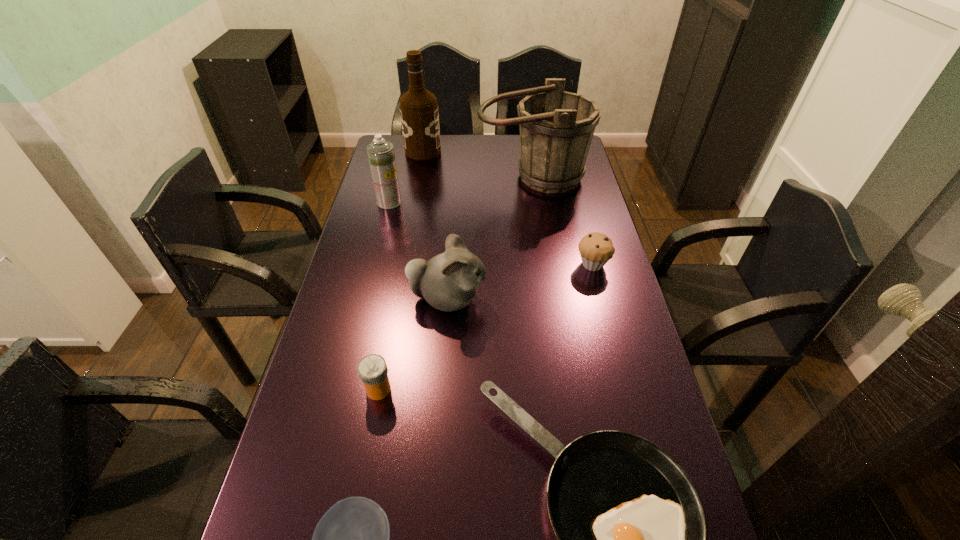
Locate an element on the screen. This screenshot has height=540, width=960. the tallest object is located at coordinates (419, 114).

Where is `bucket`? The image size is (960, 540). bucket is located at coordinates (556, 127).

Identify the location of the third tallest object. The image size is (960, 540). (380, 152).

This screenshot has height=540, width=960. What are the coordinates of `hamster` in the screenshot? It's located at [448, 281].

Image resolution: width=960 pixels, height=540 pixels. What are the coordinates of `the fifth shortest object` in the screenshot? It's located at (448, 281).

Image resolution: width=960 pixels, height=540 pixels. I want to click on muffin, so click(596, 249).

Find the location of `medicine`. medicine is located at coordinates (372, 369).

Find the location of a particular element. blank area located 0.250m on the label of the tallest object is located at coordinates (501, 151).

Where is `blank area located on the handle side of the bucket`? The image size is (960, 540). blank area located on the handle side of the bucket is located at coordinates (539, 222).

Identify the location of vacant space located 0.270m on the back of the aerosol can. (400, 157).